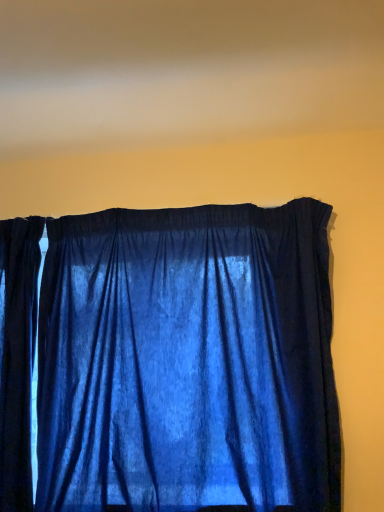
What do you see at coordinates (170, 361) in the screenshot? I see `velvet blue curtain at center` at bounding box center [170, 361].

At what (x,y) coordinates should I click in order to perform the action: click on velvet blue curtain at center. Please return your answer as a coordinate pair (x, y). Image resolution: width=384 pixels, height=512 pixels. Looking at the image, I should click on (170, 361).

The image size is (384, 512). Identify the location of blue velvet curtain at upper center. (x=185, y=69).

The image size is (384, 512). What do you see at coordinates (185, 69) in the screenshot? I see `blue velvet curtain at upper center` at bounding box center [185, 69].

Where is `velvet blue curtain at center`? velvet blue curtain at center is located at coordinates (170, 361).

Between velvet blue curtain at center and blue velvet curtain at upper center, which one appears on the left side from the viewer's perspective?

velvet blue curtain at center is more to the left.

From the picture: Which object is further away from the camera taking this photo, velvet blue curtain at center or blue velvet curtain at upper center?

velvet blue curtain at center is further away from the camera.

Is point (157, 248) closer to viewer compared to point (326, 41)?

No, it is behind (326, 41).

From the image's perspective, which object appears higher, velvet blue curtain at center or blue velvet curtain at upper center?

blue velvet curtain at upper center is shown above in the image.

From a real-world perspective, which is physically below, velvet blue curtain at center or blue velvet curtain at upper center?

velvet blue curtain at center.

Can you confirm if velvet blue curtain at center is thinner than blue velvet curtain at upper center?

Indeed, velvet blue curtain at center has a lesser width compared to blue velvet curtain at upper center.

Consider the image. Who is taller, velvet blue curtain at center or blue velvet curtain at upper center?

With more height is velvet blue curtain at center.

Looking at this image, can you confirm if velvet blue curtain at center is bigger than blue velvet curtain at upper center?

Yes.

Is velvet blue curtain at center located outside blue velvet curtain at upper center?

Yes, velvet blue curtain at center is located beyond the bounds of blue velvet curtain at upper center.

Is velvet blue curtain at center far away from blue velvet curtain at upper center?

No, velvet blue curtain at center is in close proximity to blue velvet curtain at upper center.

Is velvet blue curtain at center aimed at blue velvet curtain at upper center?

No, velvet blue curtain at center is not oriented towards blue velvet curtain at upper center.

At what (x,y) coordinates should I click in order to perform the action: click on curtain behind the blue velvet curtain at upper center. Please return your answer as a coordinate pair (x, y). The width and height of the screenshot is (384, 512). Looking at the image, I should click on (170, 361).

Considering the positions of objects blue velvet curtain at upper center and velvet blue curtain at center in the image provided, who is more to the right, blue velvet curtain at upper center or velvet blue curtain at center?

blue velvet curtain at upper center is more to the right.

Between blue velvet curtain at upper center and velvet blue curtain at center, which one is positioned in front?

blue velvet curtain at upper center is in front.

Which is closer, (x=268, y=14) or (x=181, y=413)?

Clearly, point (x=268, y=14) is closer to the camera than point (x=181, y=413).

From the image's perspective, which one is positioned higher, blue velvet curtain at upper center or velvet blue curtain at center?

blue velvet curtain at upper center.

Consider the image. From a real-world perspective, does blue velvet curtain at upper center sit lower than velvet blue curtain at center?

No, from a real-world perspective, blue velvet curtain at upper center is not under velvet blue curtain at center.

Which object is thinner, blue velvet curtain at upper center or velvet blue curtain at center?

velvet blue curtain at center is thinner.

Who is taller, blue velvet curtain at upper center or velvet blue curtain at center?

velvet blue curtain at center is taller.

Between blue velvet curtain at upper center and velvet blue curtain at center, which one has smaller size?

With smaller size is blue velvet curtain at upper center.

Is blue velvet curtain at upper center inside the boundaries of velvet blue curtain at center, or outside?

blue velvet curtain at upper center is outside velvet blue curtain at center.

Is blue velvet curtain at upper center not close to velvet blue curtain at center?

No, blue velvet curtain at upper center is in close proximity to velvet blue curtain at center.

Is velvet blue curtain at center at the back of blue velvet curtain at upper center?

No, blue velvet curtain at upper center's orientation is not away from velvet blue curtain at center.

Locate an element on the screen. This screenshot has width=384, height=512. blind above the velvet blue curtain at center (from a real-world perspective) is located at coordinates (185, 69).

Where is `blind that appears on the right of velvet blue curtain at center`? The height and width of the screenshot is (512, 384). blind that appears on the right of velvet blue curtain at center is located at coordinates (185, 69).

Where is `blind located in front of the velvet blue curtain at center`? The height and width of the screenshot is (512, 384). blind located in front of the velvet blue curtain at center is located at coordinates (185, 69).